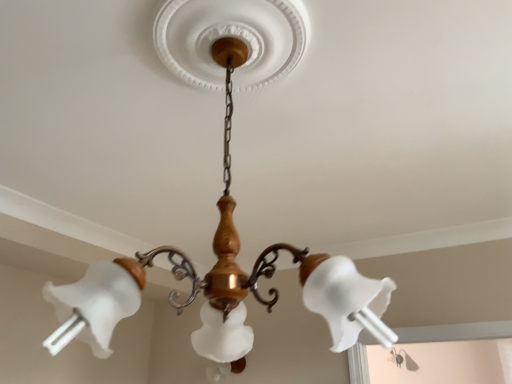
At what (x,y) coordinates should I click in order to perform the action: click on matte white glass lamp at center. Please return your answer as a coordinate pair (x, y). The width and height of the screenshot is (512, 384). Looking at the image, I should click on (224, 207).

The width and height of the screenshot is (512, 384). What do you see at coordinates (224, 207) in the screenshot?
I see `matte white glass lamp at center` at bounding box center [224, 207].

Locate an element on the screen. This screenshot has width=512, height=384. matte white glass lamp at center is located at coordinates (224, 207).